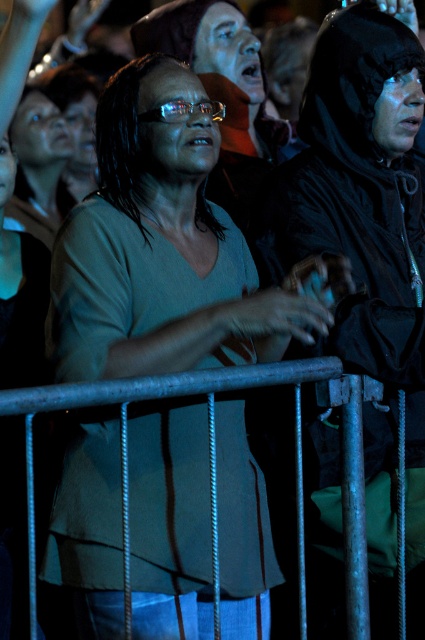
You are a photographer trying to capture a candid shot of the crowd at the event. You notice the matte green shirt at center and the metallic gray rail at center. Which object should you focus on if you want to include both in the frame without cropping either, considering their sizes?

The matte green shirt at center has a lesser width compared to metallic gray rail at center, so you should focus on the metallic gray rail at center as it is wider and will require more space in the frame.